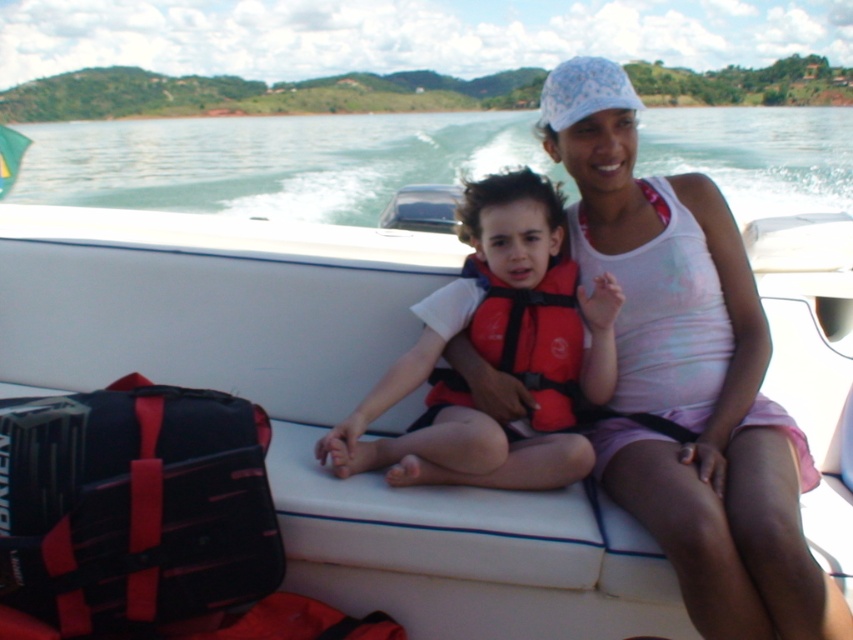
What are the coordinates of the white matte boat at center?

The white matte boat at center is located at coordinates point (320, 410).